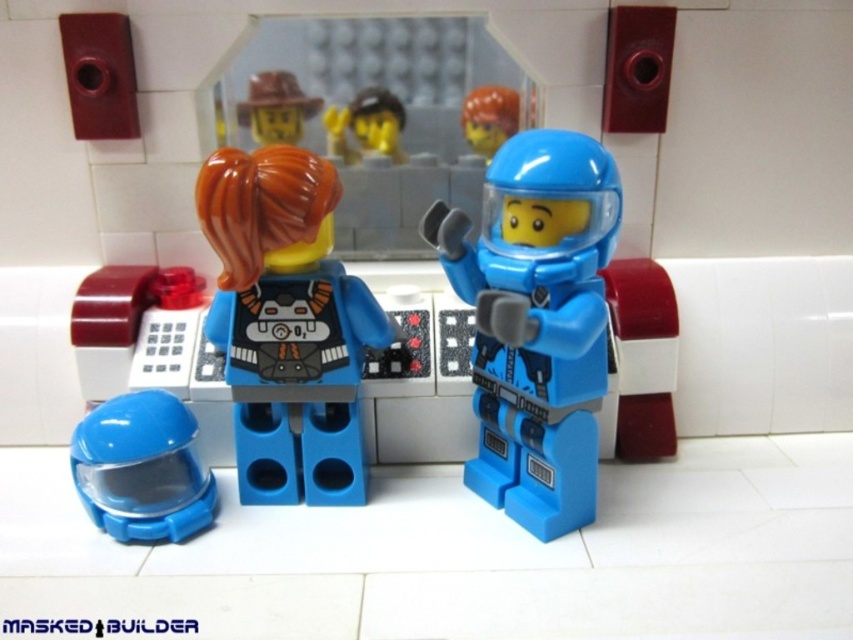
Question: Which point appears farthest from the camera in this image?

Choices:
 (A) (276, 81)
 (B) (519, 412)
 (C) (329, 298)
 (D) (339, 140)

Answer: (D)

Question: Which point is closer to the camera?

Choices:
 (A) blue plastic helmet at lower left
 (B) blue plastic astronaut at center
 (C) translucent orange hair at center
 (D) smooth yellow helmet at center

Answer: (B)

Question: Does blue plastic helmet at lower left have a lesser width compared to yellow plastic head at center?

Choices:
 (A) yes
 (B) no

Answer: (B)

Question: Among these points, which one is farthest from the camera?

Choices:
 (A) (345, 472)
 (B) (370, 108)
 (C) (486, 474)
 (D) (83, 484)

Answer: (B)

Question: Does translucent orange hair at center have a smaller size compared to blue plastic helmet at lower left?

Choices:
 (A) yes
 (B) no

Answer: (B)

Question: Can you confirm if yellow plastic head at center is thinner than matte yellow helmet at upper center?

Choices:
 (A) no
 (B) yes

Answer: (B)